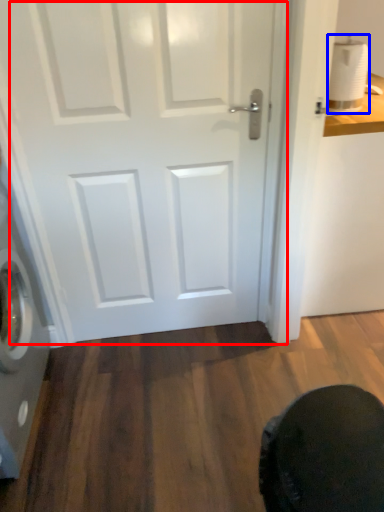
Question: Which object is further to the camera taking this photo, door (highlighted by a red box) or toilet paper (highlighted by a blue box)?

Choices:
 (A) door
 (B) toilet paper

Answer: (B)